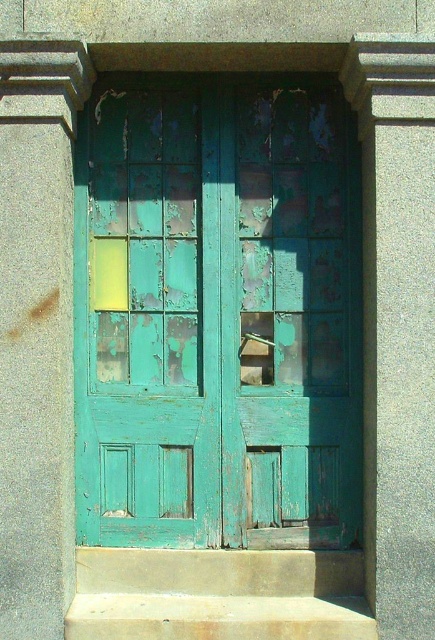
Question: Where is peeling teal wood door at center located in relation to concrete steps at center in the image?

Choices:
 (A) right
 (B) left

Answer: (B)

Question: Which of the following is the farthest from the observer?

Choices:
 (A) (325, 356)
 (B) (93, 611)

Answer: (A)

Question: Can you confirm if peeling teal wood door at center is positioned above concrete steps at center?

Choices:
 (A) yes
 (B) no

Answer: (A)

Question: Does peeling teal wood door at center have a smaller size compared to concrete steps at center?

Choices:
 (A) yes
 (B) no

Answer: (B)